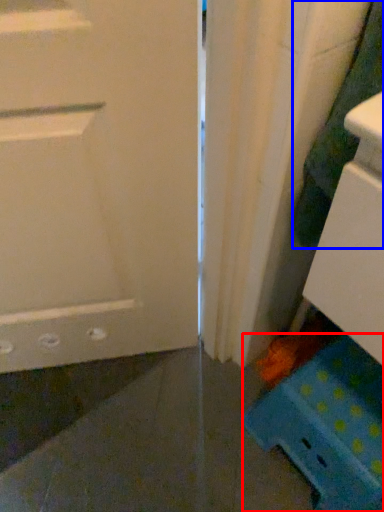
Question: Among these objects, which one is farthest to the camera, cabinetry (highlighted by a red box) or laundry (highlighted by a blue box)?

Choices:
 (A) cabinetry
 (B) laundry

Answer: (A)